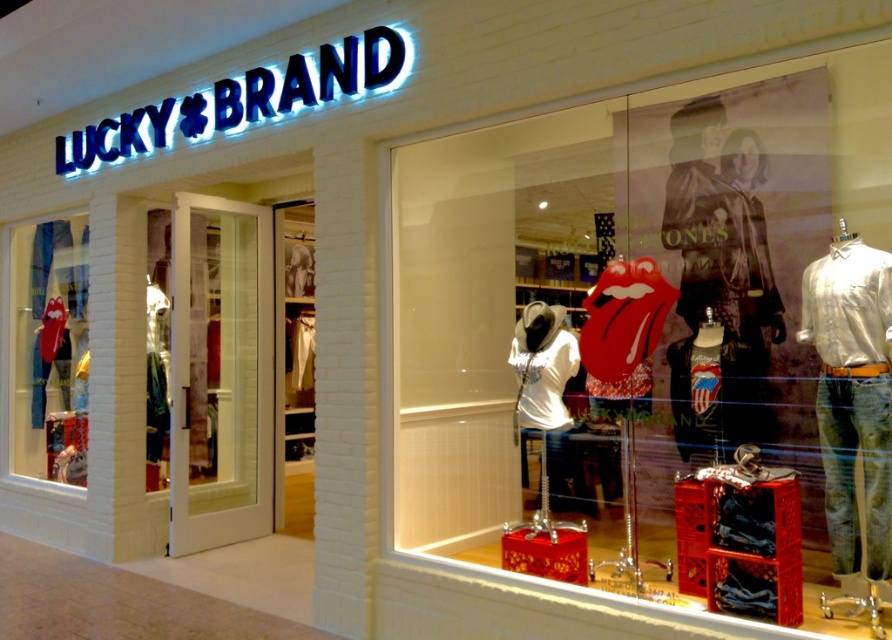
Question: Can you confirm if matte red crate at center is smaller than matte red lips at left?

Choices:
 (A) no
 (B) yes

Answer: (A)

Question: Which point is closer to the camera?

Choices:
 (A) matte red lips at left
 (B) matte red crate at center

Answer: (B)

Question: Is matte red crate at center positioned before matte red lips at left?

Choices:
 (A) no
 (B) yes

Answer: (B)

Question: Does matte red crate at center have a lesser width compared to matte red lips at left?

Choices:
 (A) no
 (B) yes

Answer: (A)